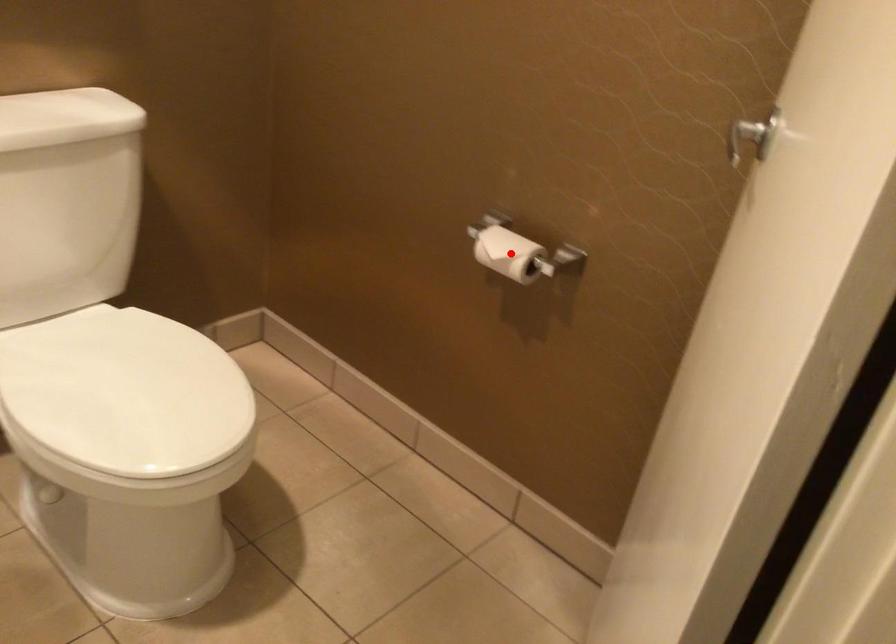
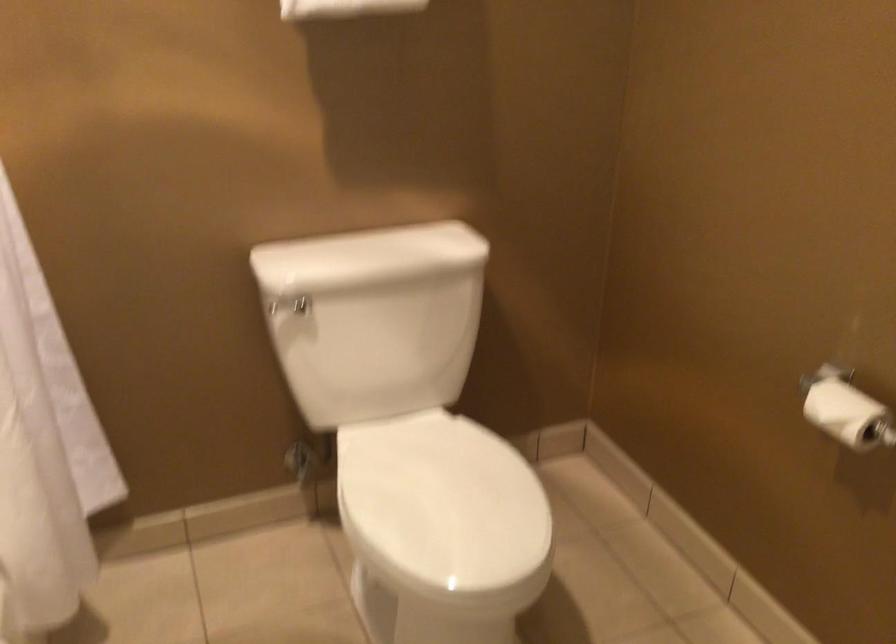
Find the pixel in the second image that matches the highlighted location in the first image.

(847, 413)